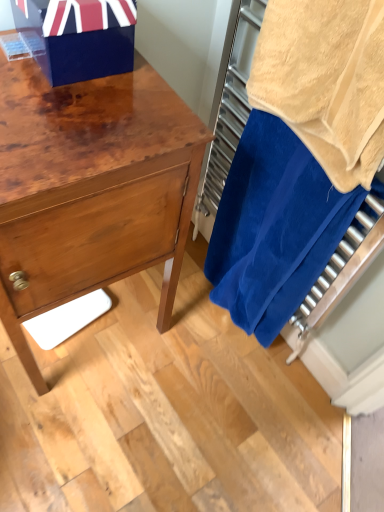
Question: Is shiny wood chest of drawers at left closer to camera compared to blue terry cloth towel at right?

Choices:
 (A) yes
 (B) no

Answer: (A)

Question: From the image's perspective, is shiny wood chest of drawers at left under blue terry cloth towel at right?

Choices:
 (A) no
 (B) yes

Answer: (B)

Question: Does shiny wood chest of drawers at left have a larger size compared to blue terry cloth towel at right?

Choices:
 (A) yes
 (B) no

Answer: (A)

Question: Can you confirm if shiny wood chest of drawers at left is taller than blue terry cloth towel at right?

Choices:
 (A) no
 (B) yes

Answer: (B)

Question: From a real-world perspective, is shiny wood chest of drawers at left over blue terry cloth towel at right?

Choices:
 (A) yes
 (B) no

Answer: (B)

Question: Considering their positions, is shiny wood chest of drawers at left located in front of or behind blue terry cloth towel at right?

Choices:
 (A) front
 (B) behind

Answer: (A)

Question: Based on their sizes in the image, would you say shiny wood chest of drawers at left is bigger or smaller than blue terry cloth towel at right?

Choices:
 (A) small
 (B) big

Answer: (B)

Question: Does point (19, 155) appear closer or farther from the camera than point (249, 200)?

Choices:
 (A) farther
 (B) closer

Answer: (B)

Question: In terms of width, does shiny wood chest of drawers at left look wider or thinner when compared to blue terry cloth towel at right?

Choices:
 (A) thin
 (B) wide

Answer: (B)

Question: In terms of size, does shiny wood chest of drawers at left appear bigger or smaller than beige terry cloth towel at right?

Choices:
 (A) big
 (B) small

Answer: (A)

Question: Is shiny wood chest of drawers at left wider or thinner than beige terry cloth towel at right?

Choices:
 (A) thin
 (B) wide

Answer: (B)

Question: In the image, is shiny wood chest of drawers at left on the left side or the right side of beige terry cloth towel at right?

Choices:
 (A) left
 (B) right

Answer: (A)

Question: Is shiny wood chest of drawers at left inside the boundaries of beige terry cloth towel at right, or outside?

Choices:
 (A) outside
 (B) inside

Answer: (A)

Question: Looking at the image, does blue terry cloth towel at right seem bigger or smaller compared to shiny wood chest of drawers at left?

Choices:
 (A) big
 (B) small

Answer: (B)

Question: Is point (243, 15) positioned closer to the camera than point (148, 260)?

Choices:
 (A) farther
 (B) closer

Answer: (A)